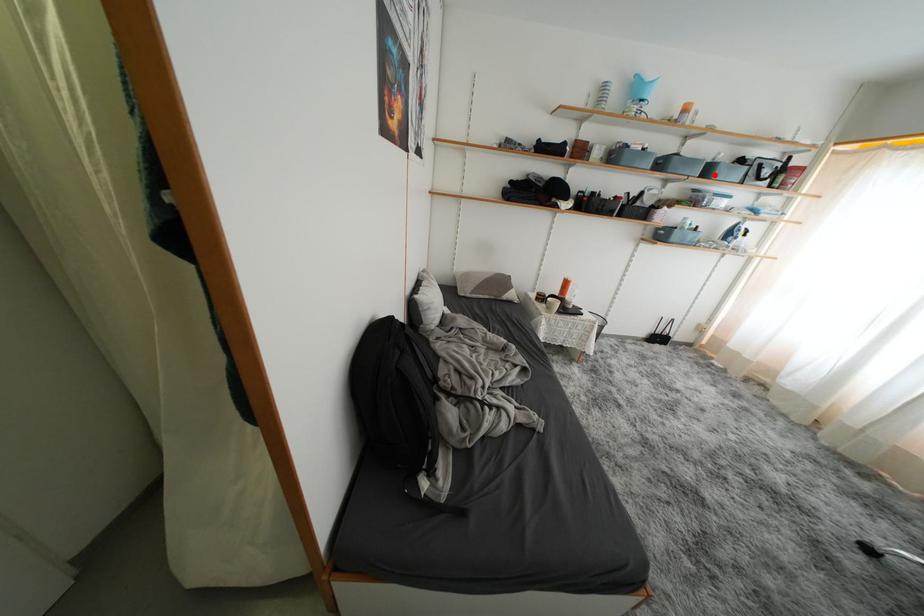
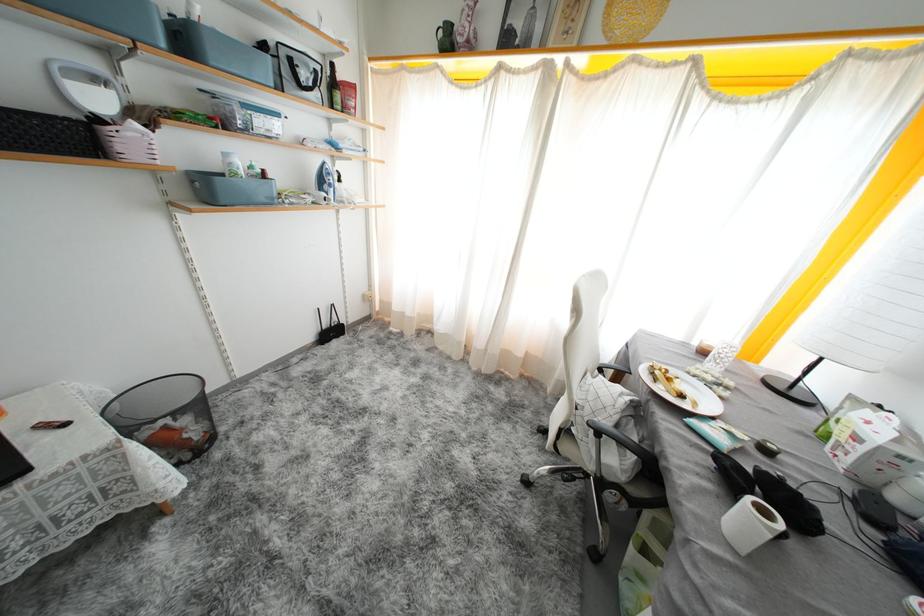
In the second image, find the point that corresponds to the highlighted location in the first image.

(190, 44)